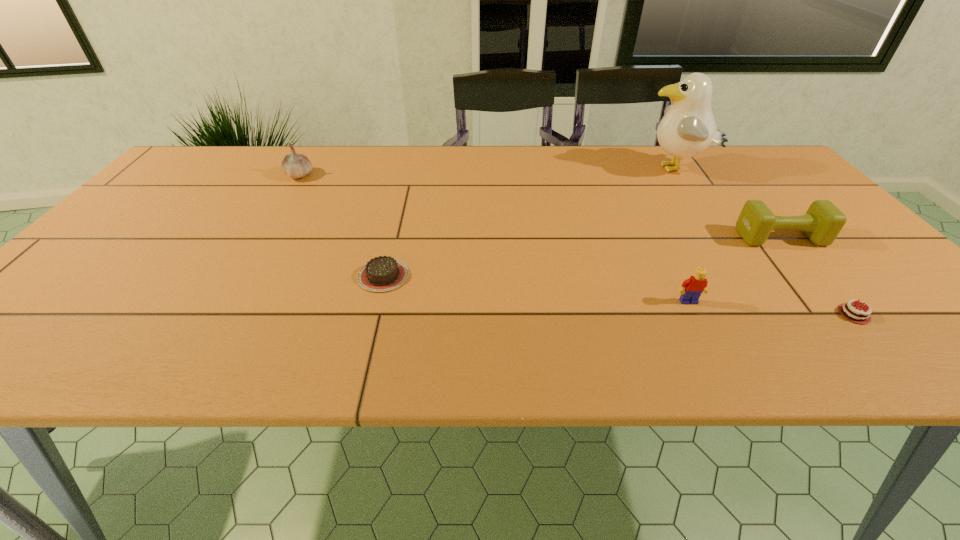
Identify the location of vacant area that lies between the fifth object from right to left and the right chocolate cake. The height and width of the screenshot is (540, 960). (618, 295).

Where is `free spot between the third object from left to right and the dumbbell`? free spot between the third object from left to right and the dumbbell is located at coordinates (734, 269).

I want to click on vacant space that's between the garlic and the right chocolate cake, so click(577, 245).

The image size is (960, 540). In order to click on object that ranks as the third closest to the right chocolate cake in this screenshot , I will do `click(688, 128)`.

At what (x,y) coordinates should I click in order to perform the action: click on object that is the fourth closest to the dumbbell. Please return your answer as a coordinate pair (x, y). The height and width of the screenshot is (540, 960). Looking at the image, I should click on (382, 273).

Identify the location of free region that satisfies the following two spatial constraints: 1. on the beak of the gull; 2. on the face of the Lego. (763, 302).

The width and height of the screenshot is (960, 540). I want to click on vacant area that satisfies the following two spatial constraints: 1. on the beak of the tallest object; 2. on the right side of the third farthest object, so click(720, 237).

At what (x,y) coordinates should I click in order to perform the action: click on vacant space that satisfies the following two spatial constraints: 1. on the beak of the tallest object; 2. on the face of the third object from left to right. Please return your answer as a coordinate pair (x, y). The height and width of the screenshot is (540, 960). Looking at the image, I should click on (763, 302).

Locate an element on the screen. blank space that satisfies the following two spatial constraints: 1. on the beak of the gull; 2. on the back side of the dumbbell is located at coordinates (720, 237).